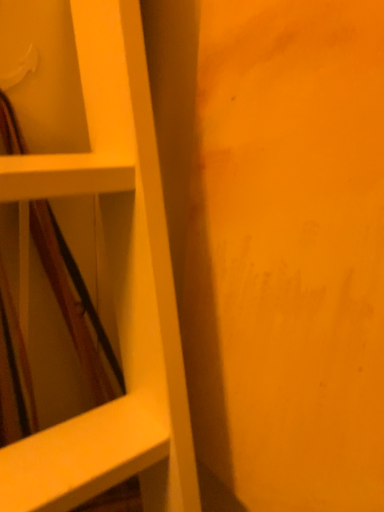
Measure the distance between point (x=100, y=42) and camera.

Point (x=100, y=42) is 15.04 inches away from camera.

What do you see at coordinates (115, 288) in the screenshot? Image resolution: width=384 pixels, height=512 pixels. I see `white matte shelf at left` at bounding box center [115, 288].

This screenshot has height=512, width=384. Find the location of `white matte shelf at left`. white matte shelf at left is located at coordinates (115, 288).

Image resolution: width=384 pixels, height=512 pixels. I want to click on white matte shelf at left, so click(x=115, y=288).